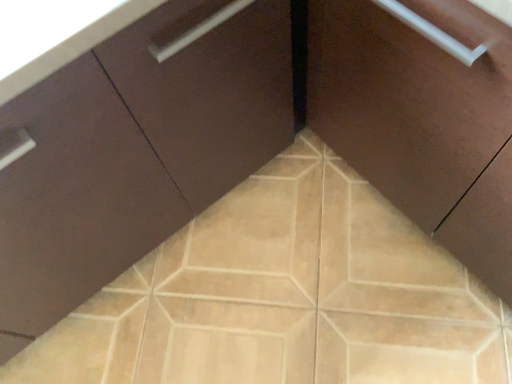
This screenshot has width=512, height=384. In order to click on free spot above beige ceramic tile at center (from a real-world perspective) in this screenshot , I will do `click(268, 312)`.